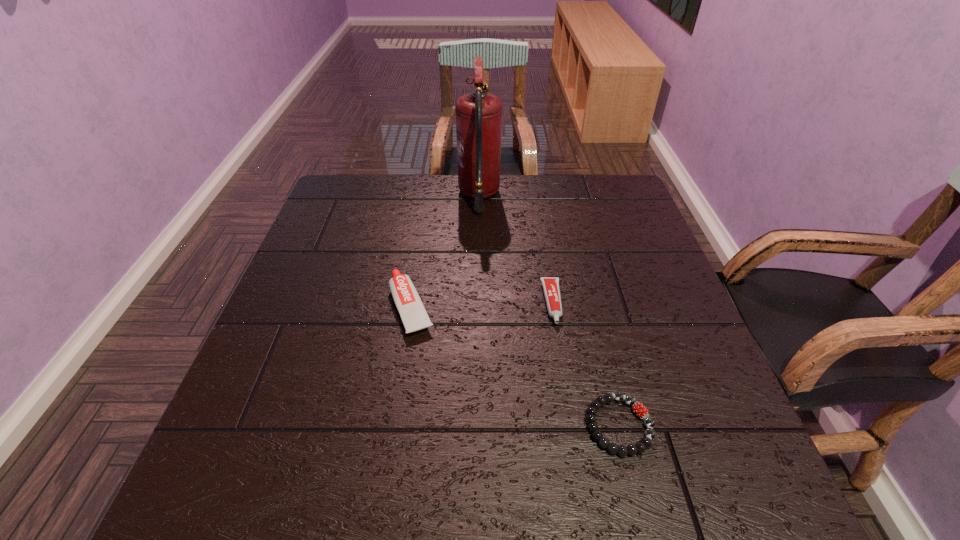
This screenshot has width=960, height=540. I want to click on vacant space situated at the nozzle of the shorter toothpaste, so click(560, 349).

In order to click on free space located 0.270m on the left of the shortest object in this screenshot , I will do `click(431, 425)`.

This screenshot has height=540, width=960. Find the location of `object located in the far edge section of the desktop`. object located in the far edge section of the desktop is located at coordinates click(478, 114).

Find the location of `object that is at the near edge`. object that is at the near edge is located at coordinates (640, 410).

The width and height of the screenshot is (960, 540). I want to click on object positioned at the right edge, so click(x=640, y=410).

Identify the location of object that is at the near right corner. This screenshot has width=960, height=540. (640, 410).

Where is `vacant region at the far edge of the desktop`? The height and width of the screenshot is (540, 960). vacant region at the far edge of the desktop is located at coordinates (418, 205).

The width and height of the screenshot is (960, 540). I want to click on vacant space at the near edge of the desktop, so click(x=371, y=510).

This screenshot has height=540, width=960. In the image, there is a desktop. Identify the location of free space at the left edge. (281, 353).

Image resolution: width=960 pixels, height=540 pixels. In the image, there is a desktop. What are the coordinates of `free space at the right edge` in the screenshot? It's located at (621, 231).